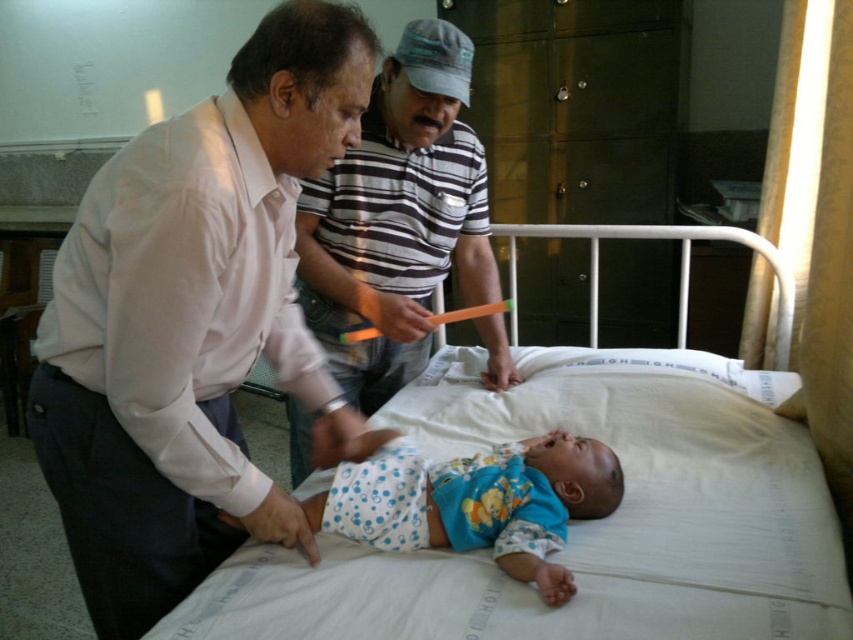
Between striped cotton shirt at center and blue dotted fabric at center, which one appears on the right side from the viewer's perspective?

From the viewer's perspective, blue dotted fabric at center appears more on the right side.

Who is more forward, (479, 160) or (555, 460)?

Point (555, 460)

Image resolution: width=853 pixels, height=640 pixels. I want to click on striped cotton shirt at center, so click(x=397, y=218).

Who is more forward, [537,515] or [424,476]?

Positioned in front is point [537,515].

From the picture: Can you confirm if blue dotted fabric at center is positioned above blue dotted fabric diaper at center?

Incorrect, blue dotted fabric at center is not positioned above blue dotted fabric diaper at center.

Which is in front, point (538, 509) or point (343, 481)?

Positioned in front is point (538, 509).

At what (x,y) coordinates should I click in order to perform the action: click on blue dotted fabric at center. Please return your answer as a coordinate pair (x, y). Looking at the image, I should click on (474, 500).

Consider the image. Is white fabric bed at center to the left of blue dotted fabric diaper at center from the viewer's perspective?

Incorrect, white fabric bed at center is not on the left side of blue dotted fabric diaper at center.

Based on the photo, is white fabric bed at center shorter than blue dotted fabric diaper at center?

No, white fabric bed at center is not shorter than blue dotted fabric diaper at center.

Is point (457, 636) farther from camera compared to point (374, 508)?

No, it is not.

Identify the location of white fabric bed at center. This screenshot has height=640, width=853. (581, 522).